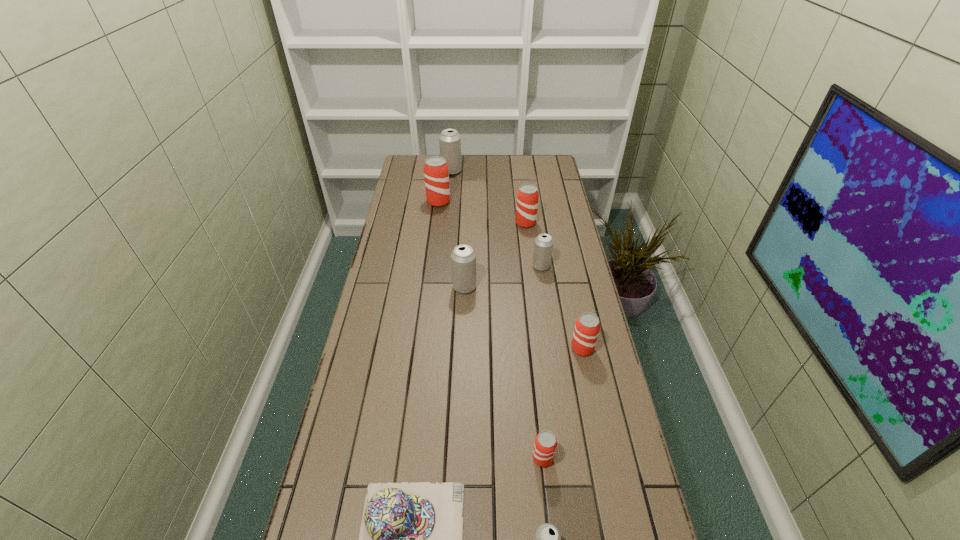
I want to click on the farthest white beer can, so click(x=449, y=140).

The height and width of the screenshot is (540, 960). In order to click on the farthest beer can in this screenshot , I will do `click(449, 140)`.

The image size is (960, 540). Identify the location of the biggest orange beer can. (436, 173).

The width and height of the screenshot is (960, 540). Identify the location of the eighth nearest object. (436, 173).

Find the location of a particular element. This screenshot has height=540, width=960. the third farthest beer can is located at coordinates (527, 196).

Where is `the second biggest orange beer can`? the second biggest orange beer can is located at coordinates (527, 196).

You are a GUI agent. You are given a task and a screenshot of the screen. Output one action in this format:
    pyautogui.click(x=<x>, y=<y>)
    Task: Click on the fourth nearest beer can
    The height and width of the screenshot is (540, 960).
    Given the screenshot: What is the action you would take?
    pyautogui.click(x=463, y=258)

Find the location of a particular element. Image resolution: width=960 pixels, height=540 pixels. the second nearest white beer can is located at coordinates (463, 258).

At what (x,y) coordinates should I click in order to perform the action: click on the third biggest orange beer can. Please return your answer as a coordinate pair (x, y). The image size is (960, 540). Looking at the image, I should click on (587, 327).

This screenshot has width=960, height=540. Find the location of `the rightmost orange beer can`. the rightmost orange beer can is located at coordinates (587, 327).